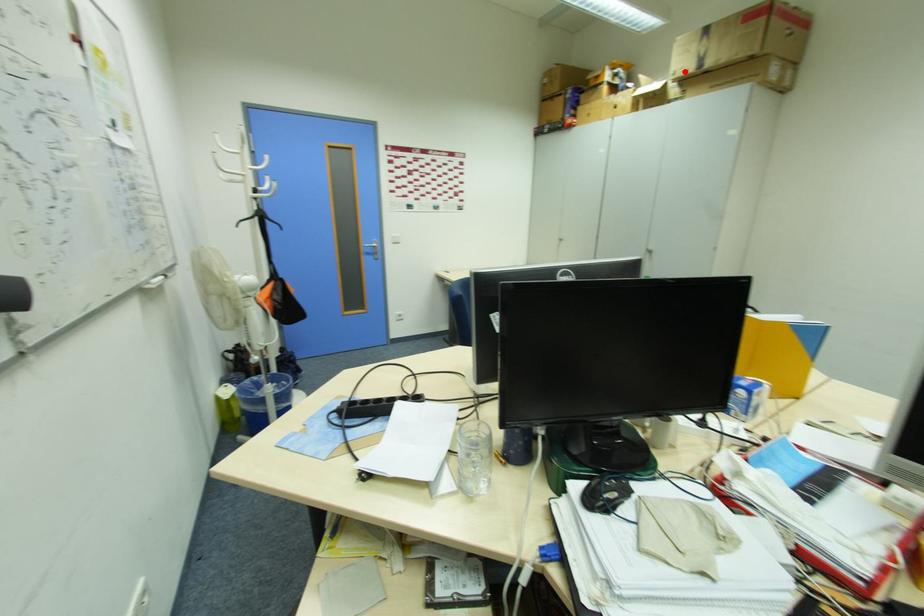
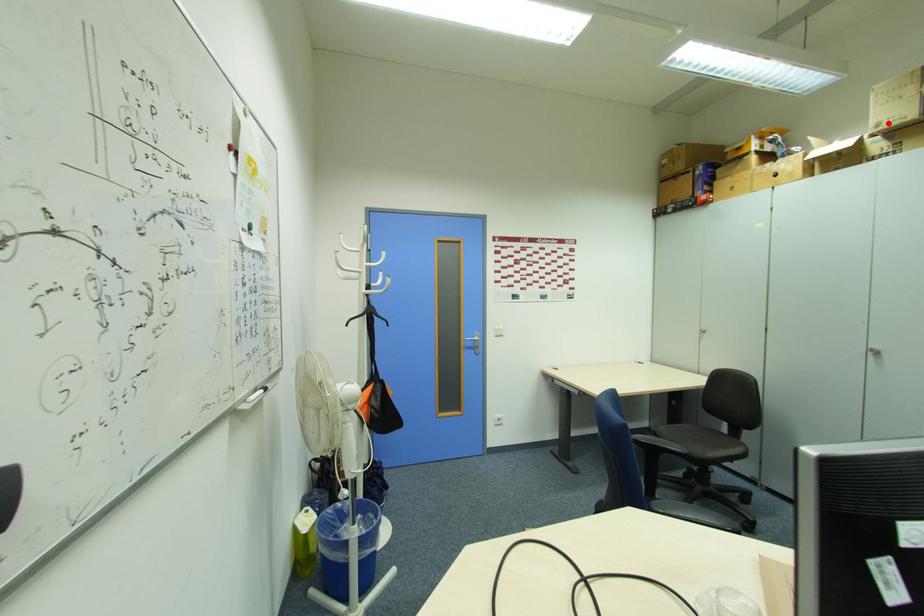
I am providing you with two images of the same scene from different viewpoints. A red point is marked on the first image and another point is marked on the second image. Do the highlighted points in image1 and image2 indicate the same real-world spot?

Yes